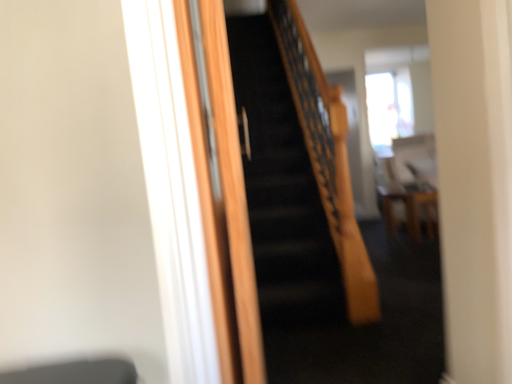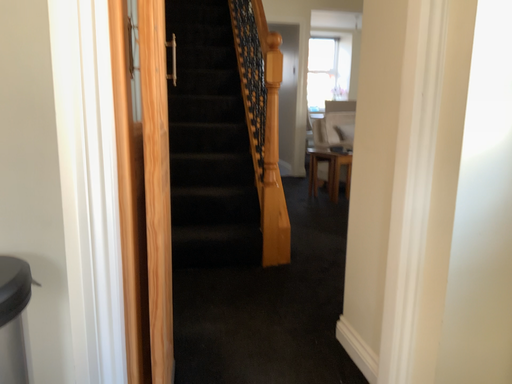
Question: How did the camera likely rotate when shooting the video?

Choices:
 (A) rotated downward
 (B) rotated upward

Answer: (A)